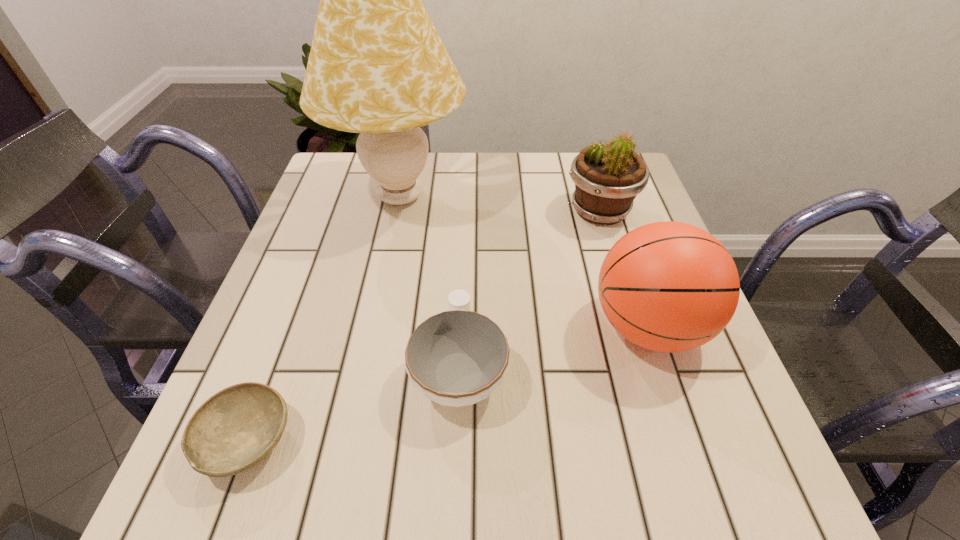
I want to click on object at the near left corner, so click(x=235, y=429).

Where is `object present at the far right corner`? object present at the far right corner is located at coordinates (607, 179).

Identify the location of vacant space at the far edge. The height and width of the screenshot is (540, 960). (442, 172).

Where is `vacant space at the near edge`? Image resolution: width=960 pixels, height=540 pixels. vacant space at the near edge is located at coordinates (411, 502).

This screenshot has height=540, width=960. In the image, there is a desktop. Find the location of `free space at the left edge`. free space at the left edge is located at coordinates (314, 265).

Where is `free point between the lampshade and the flowerpot`? The width and height of the screenshot is (960, 540). free point between the lampshade and the flowerpot is located at coordinates (500, 204).

This screenshot has width=960, height=540. Find the location of `vacant space that's between the tallest object and the basketball`. vacant space that's between the tallest object and the basketball is located at coordinates (524, 262).

Where is `free space between the basketball and the chinaware`? This screenshot has width=960, height=540. free space between the basketball and the chinaware is located at coordinates point(554,348).

Find the location of a particular element. vacant area that lies between the basketball and the fourth tallest object is located at coordinates (554, 348).

The image size is (960, 540). I want to click on blank region between the basketball and the lampshade, so click(x=524, y=262).